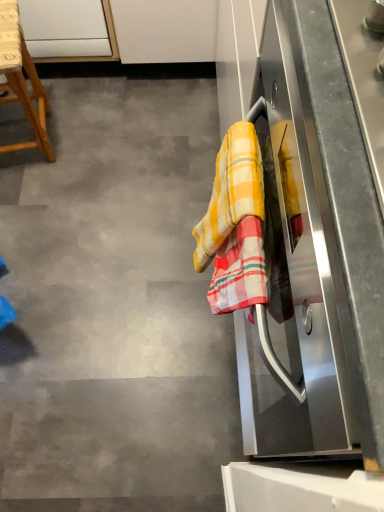
Question: Is the position of stainless steel oven at right more distant than that of wooden stool at left?

Choices:
 (A) no
 (B) yes

Answer: (A)

Question: Considering the relative sizes of stainless steel oven at right and wooden stool at left in the image provided, is stainless steel oven at right shorter than wooden stool at left?

Choices:
 (A) no
 (B) yes

Answer: (A)

Question: Could wooden stool at left be considered to be inside stainless steel oven at right?

Choices:
 (A) no
 (B) yes

Answer: (A)

Question: Is stainless steel oven at right facing towards wooden stool at left?

Choices:
 (A) yes
 (B) no

Answer: (B)

Question: Is the depth of stainless steel oven at right less than that of wooden stool at left?

Choices:
 (A) yes
 (B) no

Answer: (A)

Question: Would you say stainless steel oven at right is inside or outside plaid cotton beach towel at right?

Choices:
 (A) inside
 (B) outside

Answer: (B)

Question: From the image's perspective, relative to plaid cotton beach towel at right, is stainless steel oven at right above or below?

Choices:
 (A) below
 (B) above

Answer: (B)

Question: Considering the positions of stainless steel oven at right and plaid cotton beach towel at right in the image, is stainless steel oven at right taller or shorter than plaid cotton beach towel at right?

Choices:
 (A) tall
 (B) short

Answer: (A)

Question: From a real-world perspective, relative to plaid cotton beach towel at right, is stainless steel oven at right vertically above or below?

Choices:
 (A) above
 (B) below

Answer: (B)

Question: In the image, is stainless steel oven at right positioned in front of or behind yellow checkered towel at right?

Choices:
 (A) behind
 (B) front

Answer: (B)

Question: From a real-world perspective, is stainless steel oven at right above or below yellow checkered towel at right?

Choices:
 (A) below
 (B) above

Answer: (B)

Question: In the image, is stainless steel oven at right on the left side or the right side of yellow checkered towel at right?

Choices:
 (A) left
 (B) right

Answer: (B)

Question: In terms of height, does stainless steel oven at right look taller or shorter compared to yellow checkered towel at right?

Choices:
 (A) short
 (B) tall

Answer: (B)

Question: Is point (233, 245) closer or farther from the camera than point (225, 187)?

Choices:
 (A) farther
 (B) closer

Answer: (B)

Question: In the image, is plaid cotton beach towel at right positioned in front of or behind yellow checkered towel at right?

Choices:
 (A) behind
 (B) front

Answer: (B)